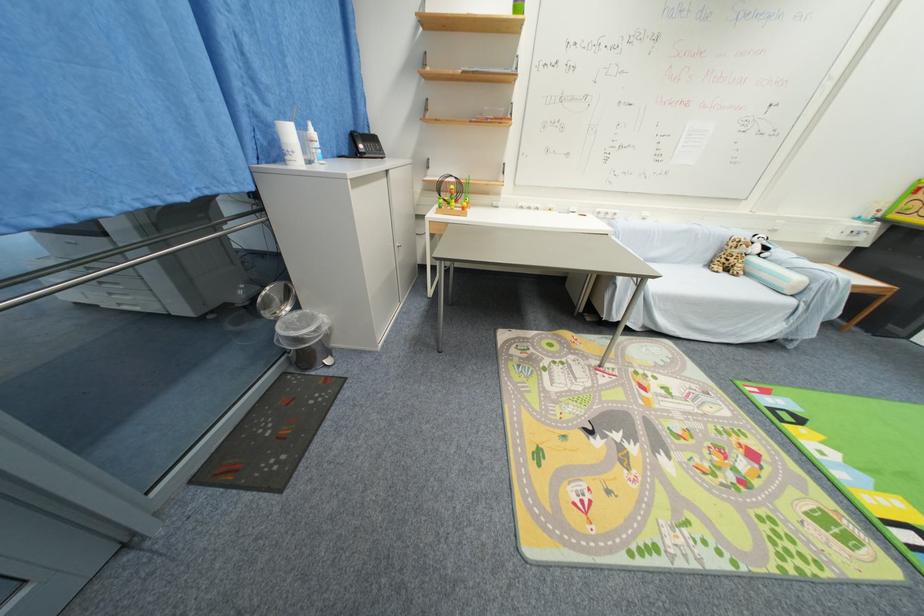
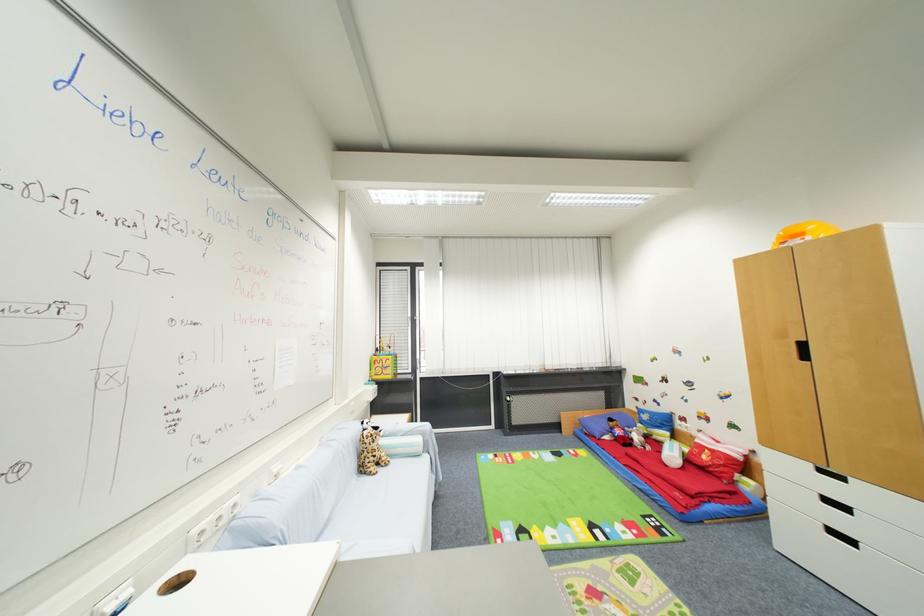
Where in the second image is the point corresponding to the point at 730,276 from the first image?

(385, 472)